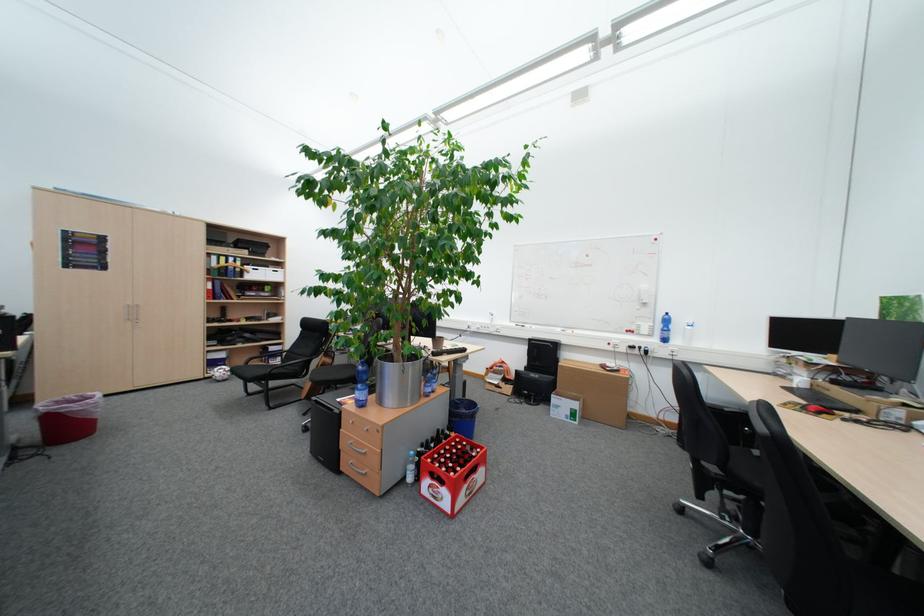
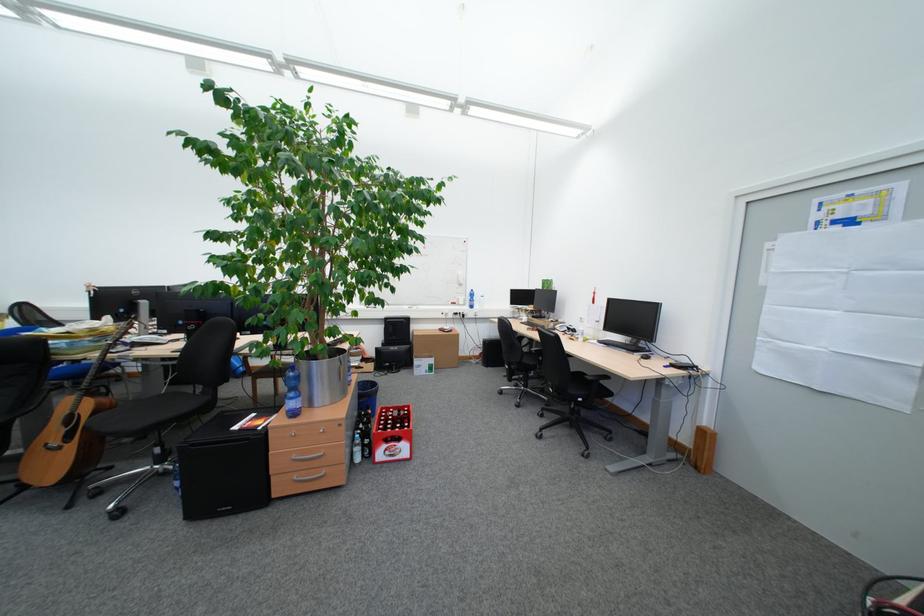
Locate, in the second image, the point that corresponds to (x=444, y=477) in the first image.

(398, 442)